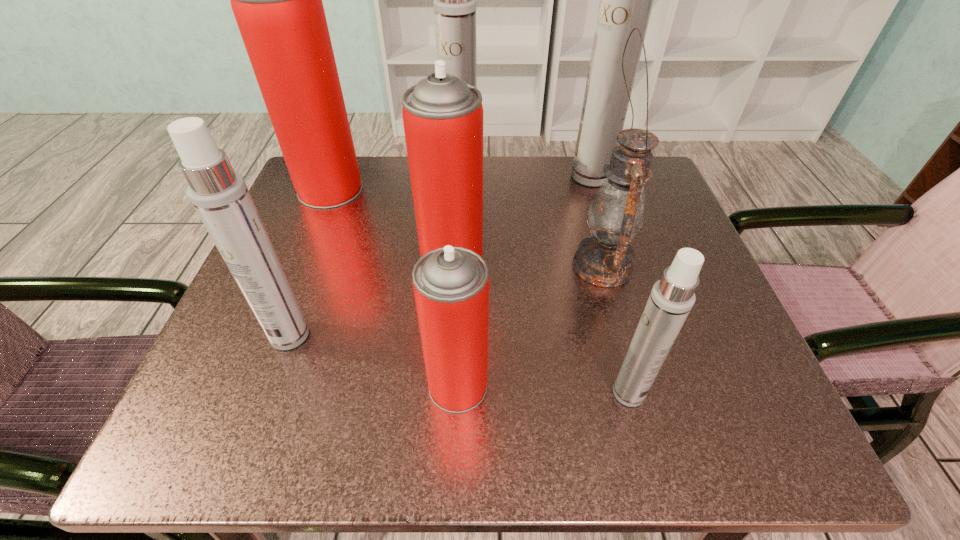
This screenshot has height=540, width=960. What are the coordinates of `white aerosol can that is the third closest one to the second smallest red aerosol can` in the screenshot? It's located at (672, 298).

Choose which red aerosol can is the second nearest neighbor to the nearest red aerosol can. Please provide its 2D coordinates. Your answer should be formatted as a tuple, i.e. [(x, y)], where the tuple contains the x and y coordinates of a point satisfying the conditions above.

[(277, 2)]

Select which red aerosol can appears as the second closest to the nearest white aerosol can. Please provide its 2D coordinates. Your answer should be formatted as a tuple, i.e. [(x, y)], where the tuple contains the x and y coordinates of a point satisfying the conditions above.

[(442, 115)]

Where is `free space that satisfies the following two spatial constraints: 1. on the front side of the smallest white aerosol can; 2. on the right side of the biggest red aerosol can`? free space that satisfies the following two spatial constraints: 1. on the front side of the smallest white aerosol can; 2. on the right side of the biggest red aerosol can is located at coordinates (248, 393).

The image size is (960, 540). I want to click on free space that satisfies the following two spatial constraints: 1. on the back side of the third nearest object; 2. on the right side of the oil lamp, so click(316, 266).